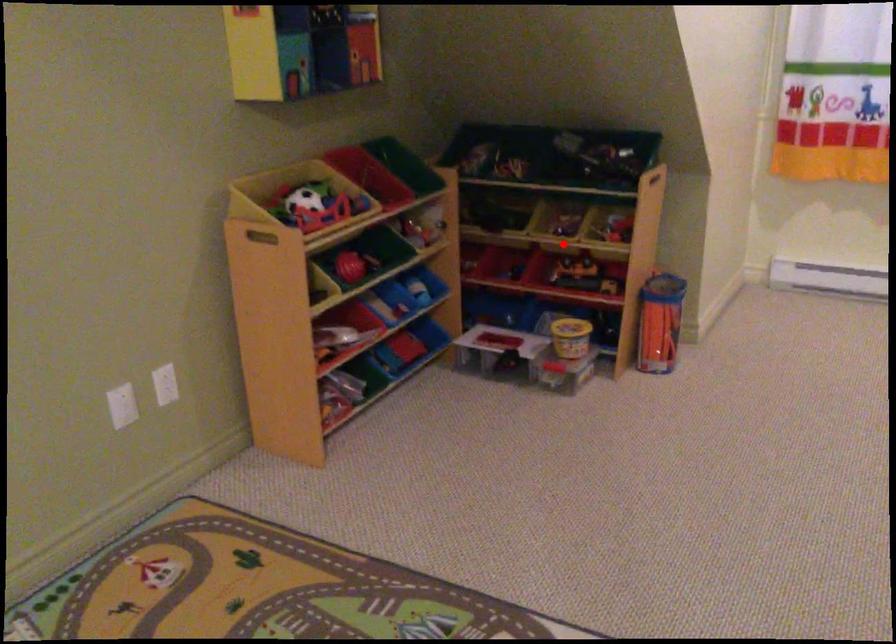
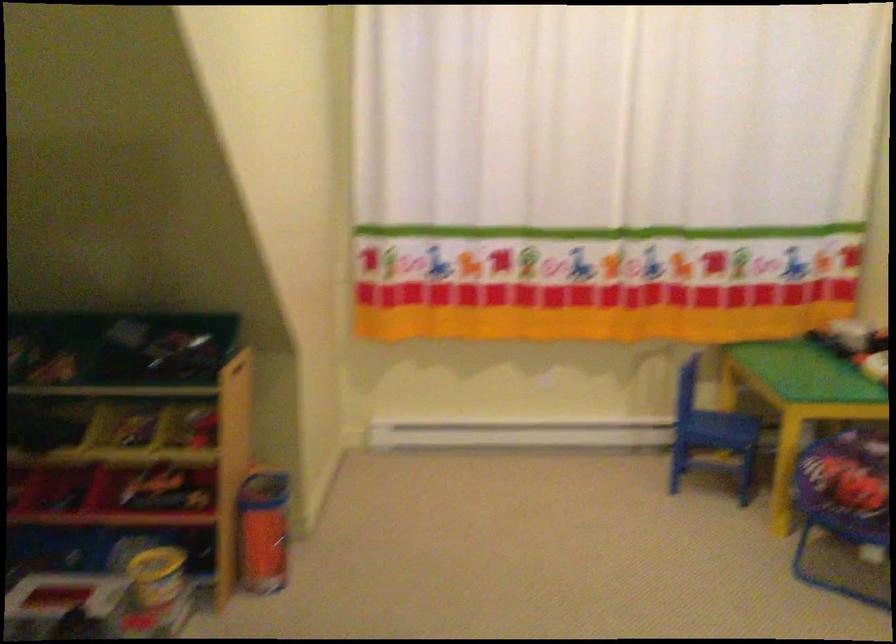
Question: I am providing you with two images of the same scene from different viewpoints. A red point is marked on the first image. At the location where the point appears in image 1, is it still visible in image 2?

Choices:
 (A) Yes
 (B) No

Answer: (A)